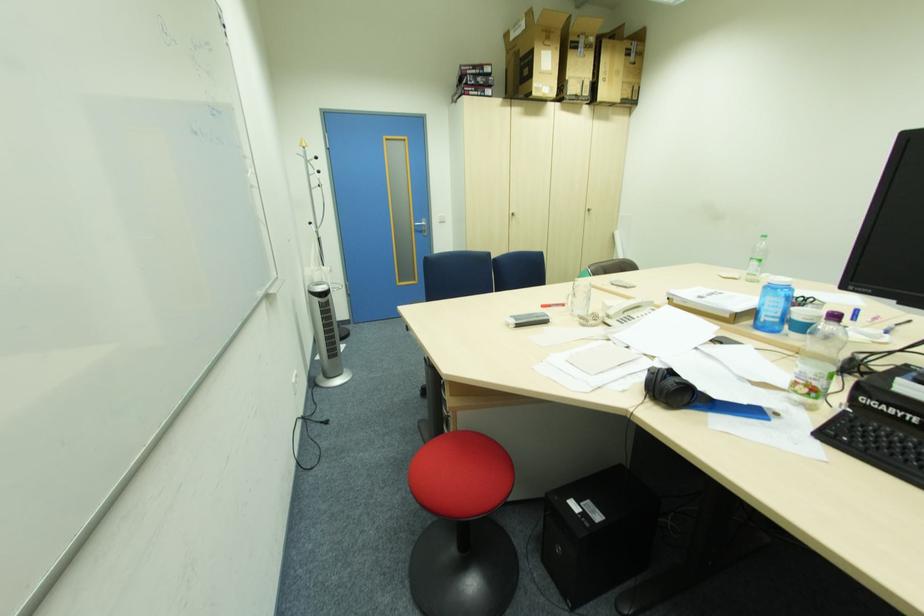
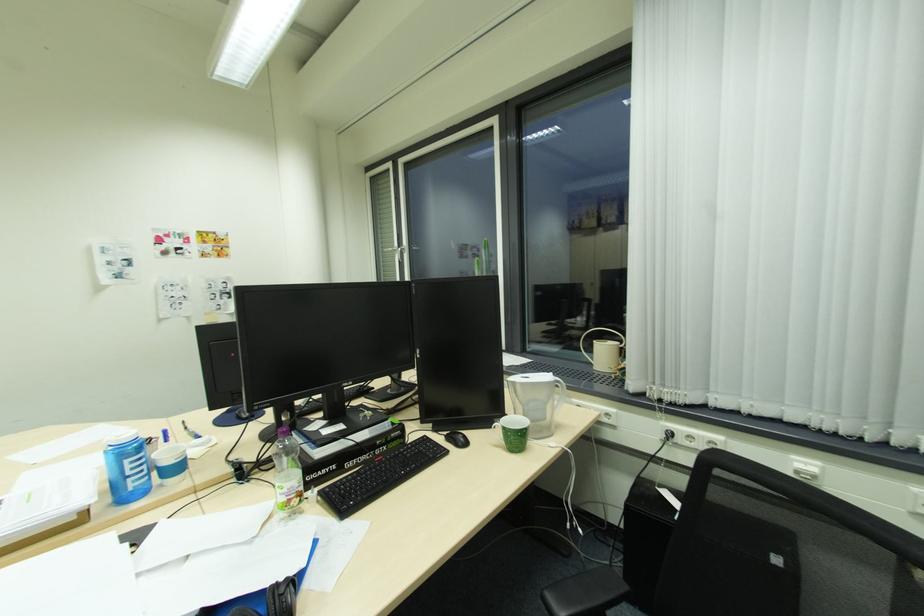
Where in the second image is the point corresponding to the point at 799,334 from the first image?

(176, 482)